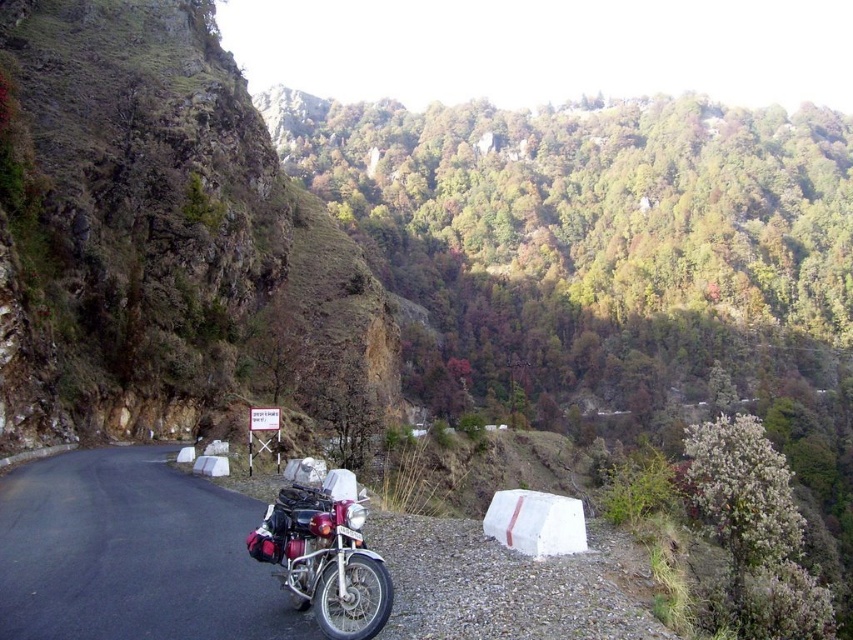
Question: Can you confirm if rugged stone cliff at left is wider than metallic motorcycle at center?

Choices:
 (A) yes
 (B) no

Answer: (A)

Question: Which of the following is the farthest from the observer?

Choices:
 (A) (143, 563)
 (B) (50, 365)
 (C) (311, 589)

Answer: (B)

Question: Does rugged stone cliff at left have a smaller size compared to shiny chrome motorcycle at center?

Choices:
 (A) yes
 (B) no

Answer: (B)

Question: Considering the real-world distances, which object is closest to the shiny chrome motorcycle at center?

Choices:
 (A) rugged stone cliff at left
 (B) metallic motorcycle at center

Answer: (B)

Question: Does metallic motorcycle at center come in front of shiny chrome motorcycle at center?

Choices:
 (A) no
 (B) yes

Answer: (B)

Question: Which object is closer to the camera taking this photo?

Choices:
 (A) shiny chrome motorcycle at center
 (B) metallic motorcycle at center
 (C) rugged stone cliff at left

Answer: (B)